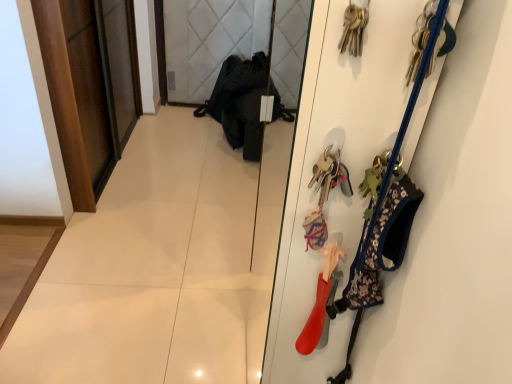
Question: Based on their sizes in the image, would you say clear glass mirror at center is bigger or smaller than rubberized red boot at right, the first accessory positioned from the bottom?

Choices:
 (A) small
 (B) big

Answer: (B)

Question: From a real-world perspective, relative to rubberized red boot at right, the first accessory positioned from the bottom, is clear glass mirror at center vertically above or below?

Choices:
 (A) below
 (B) above

Answer: (A)

Question: Based on their relative distances, which object is farther from the clear glass mirror at center?

Choices:
 (A) floral fabric dog harness at right, the 2th accessory in the bottom-to-top sequence
 (B) metallic keys at upper right, positioned as the 1th accessory in top-to-bottom order
 (C) dark wood door at left
 (D) rubberized red boot at right, the 3th accessory positioned from the top

Answer: (B)

Question: Which is nearer to the metallic keys at upper right, positioned as the 1th accessory in top-to-bottom order?

Choices:
 (A) clear glass mirror at center
 (B) floral fabric dog harness at right, which appears as the 2th accessory when viewed from the top
 (C) rubberized red boot at right, the first accessory positioned from the bottom
 (D) dark wood door at left

Answer: (B)